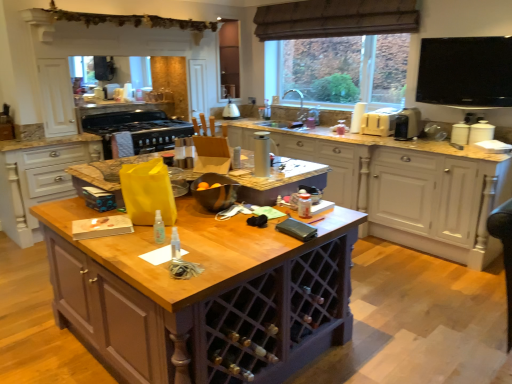
Question: Considering the relative positions of silver metallic thermos at center, the 6th appliance from the back, and metallic silver kettle at center, which ranks as the 1th appliance in back-to-front order, in the image provided, is silver metallic thermos at center, the 6th appliance from the back, behind metallic silver kettle at center, which ranks as the 1th appliance in back-to-front order,?

Choices:
 (A) no
 (B) yes

Answer: (A)

Question: Considering the relative positions of silver metallic thermos at center, arranged as the 2th appliance when viewed from the front, and metallic silver kettle at center, which is the 6th appliance from right to left, in the image provided, is silver metallic thermos at center, arranged as the 2th appliance when viewed from the front, to the right of metallic silver kettle at center, which is the 6th appliance from right to left, from the viewer's perspective?

Choices:
 (A) yes
 (B) no

Answer: (A)

Question: From the image's perspective, would you say silver metallic thermos at center, the fourth appliance when ordered from right to left, is positioned over metallic silver kettle at center, acting as the 2th appliance starting from the left?

Choices:
 (A) no
 (B) yes

Answer: (A)

Question: Is silver metallic thermos at center, arranged as the 2th appliance when viewed from the front, not close to metallic silver kettle at center, the 7th appliance from the front?

Choices:
 (A) no
 (B) yes

Answer: (B)

Question: Considering the relative positions of silver metallic thermos at center, which ranks as the fourth appliance in left-to-right order, and metallic silver kettle at center, acting as the 2th appliance starting from the left, in the image provided, is silver metallic thermos at center, which ranks as the fourth appliance in left-to-right order, in front of metallic silver kettle at center, acting as the 2th appliance starting from the left,?

Choices:
 (A) yes
 (B) no

Answer: (A)

Question: Does silver metallic thermos at center, the 6th appliance from the back, turn towards metallic silver kettle at center, which is the 6th appliance from right to left?

Choices:
 (A) yes
 (B) no

Answer: (B)

Question: Can you confirm if transparent plastic spray bottle at center is thinner than wooden island at center, the second cabinetry in the right-to-left sequence?

Choices:
 (A) yes
 (B) no

Answer: (A)

Question: Is transparent plastic spray bottle at center positioned with its back to wooden island at center, the second cabinetry in the right-to-left sequence?

Choices:
 (A) no
 (B) yes

Answer: (B)

Question: Is transparent plastic spray bottle at center placed right next to wooden island at center, the 2th cabinetry when ordered from left to right?

Choices:
 (A) no
 (B) yes

Answer: (A)

Question: Does transparent plastic spray bottle at center have a greater width compared to wooden island at center, the second cabinetry in the right-to-left sequence?

Choices:
 (A) yes
 (B) no

Answer: (B)

Question: Would you say wooden island at center, the second cabinetry in the right-to-left sequence, is part of transparent plastic spray bottle at center's contents?

Choices:
 (A) no
 (B) yes

Answer: (A)

Question: Is transparent plastic spray bottle at center positioned in front of wooden island at center, the 2th cabinetry when ordered from left to right?

Choices:
 (A) no
 (B) yes

Answer: (A)

Question: Is transparent plastic spray bottle at center surrounding beige plastic toaster at upper right, which is counted as the third appliance, starting from the right?

Choices:
 (A) no
 (B) yes

Answer: (A)